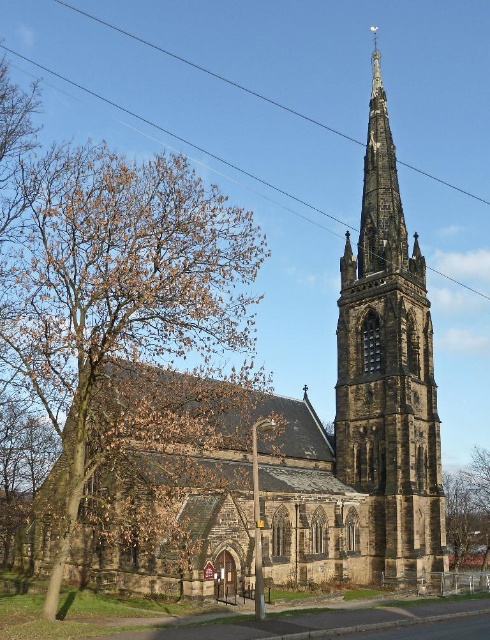
You are standing in front of the Gothic church and want to take a photo. You notice two points marked in the image. Which point, point (365,424) or point (455,564), is closer to your current position?

Point (365,424) is closer to the camera than point (455,564), so it is closer to your current position.

You are standing at the base of the Gothic church and want to take a photo of the point at coordinates point (121, 234). The camera you are using has a maximum focus range of 70 meters. Will the point be in focus?

The distance of point (121, 234) from the camera is 73.96 meters, which exceeds the camera maximum focus range of 70 meters. The point will not be in focus.

You are a photographer planning to take a photo of the black wire at upper center without the brown leafy tree at left blocking it. What adjustment should you make to your camera position?

Move your camera position to the right so that the brown leafy tree at left is no longer in front of the black wire at upper center.